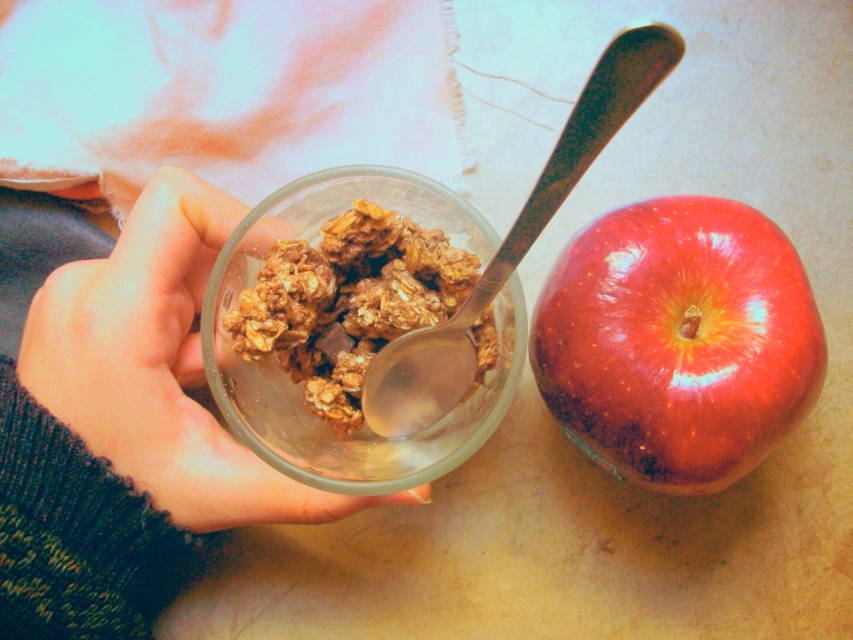
Can you confirm if shiny red apple at right is positioned to the right of satin silver spoon at center?

Yes, shiny red apple at right is to the right of satin silver spoon at center.

Looking at this image, measure the distance between point [709,243] and camera.

The distance of point [709,243] from camera is 20.01 inches.

This screenshot has height=640, width=853. I want to click on shiny red apple at right, so click(677, 340).

Which is in front, point (669, 216) or point (173, 305)?

Point (173, 305) is more forward.

Which is in front, point (630, 284) or point (234, 467)?

Point (234, 467) is in front.

This screenshot has width=853, height=640. Find the location of `shiny red apple at right`. shiny red apple at right is located at coordinates click(x=677, y=340).

Which is in front, point (664, 310) or point (434, 296)?

Point (434, 296) is in front.

Is shiny red apple at right closer to camera compared to golden crunchy granola at center?

That is False.

What do you see at coordinates (677, 340) in the screenshot? I see `shiny red apple at right` at bounding box center [677, 340].

Locate an element on the screen. shiny red apple at right is located at coordinates (677, 340).